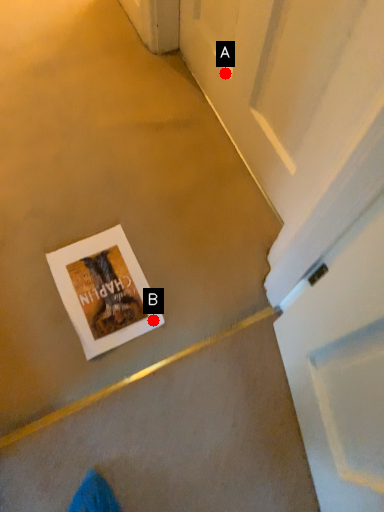
Question: Two points are circled on the image, labeled by A and B beside each circle. Which point is farther from the camera taking this photo?

Choices:
 (A) A is further
 (B) B is further

Answer: (A)